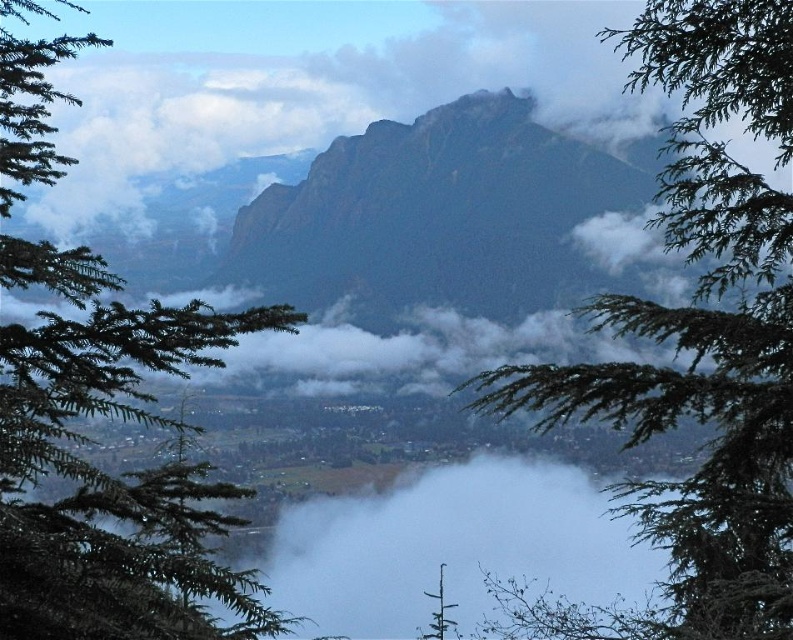
Question: Considering the relative positions of green needle-like tree at center and green matte tree at center in the image provided, where is green needle-like tree at center located with respect to green matte tree at center?

Choices:
 (A) below
 (B) above

Answer: (B)

Question: Is green needle-like branches at left wider than green matte tree at center?

Choices:
 (A) no
 (B) yes

Answer: (B)

Question: Which point is farther from the camera taking this photo?

Choices:
 (A) (10, 552)
 (B) (376, 134)

Answer: (B)

Question: Which of the following is the closest to the observer?

Choices:
 (A) rugged stone mountain at center
 (B) green needle-like branches at left
 (C) green matte tree at center

Answer: (B)

Question: Which is farther from the rugged stone mountain at center?

Choices:
 (A) green matte tree at center
 (B) green needle-like branches at left
 (C) green needle-like tree at center

Answer: (C)

Question: Does green needle-like branches at left have a greater width compared to green matte tree at center?

Choices:
 (A) no
 (B) yes

Answer: (B)